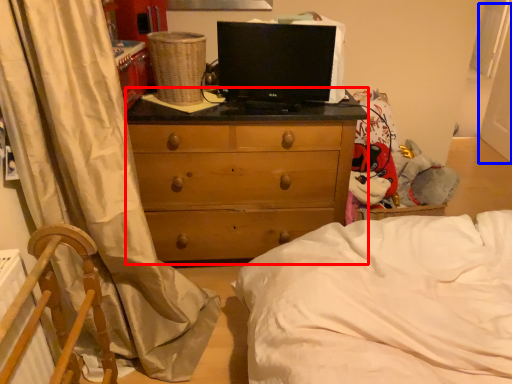
Question: Which point is further to the camera, chest of drawers (highlighted by a red box) or screen door (highlighted by a blue box)?

Choices:
 (A) chest of drawers
 (B) screen door

Answer: (B)